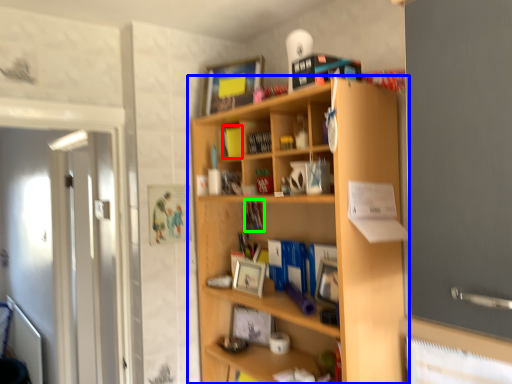
Question: Which is farther away from book (highlighted by a red box)? shelf (highlighted by a blue box) or book (highlighted by a green box)?

Choices:
 (A) shelf
 (B) book

Answer: (A)